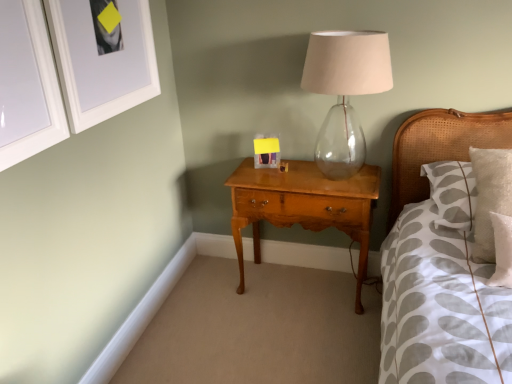
Locate an element on the screen. The height and width of the screenshot is (384, 512). free area below shiny brown wood nightstand at center (from a real-world perspective) is located at coordinates (305, 283).